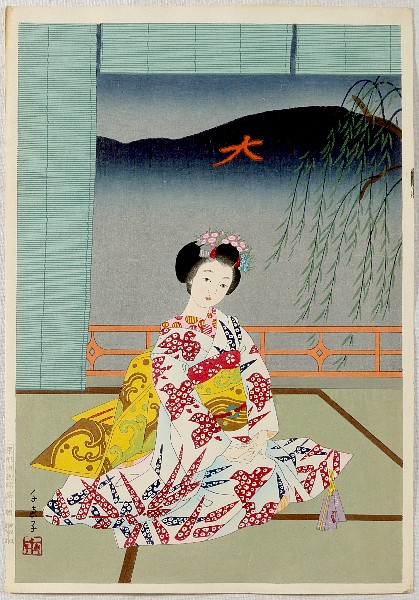
Where is `pink flowers`? The height and width of the screenshot is (600, 419). pink flowers is located at coordinates (205, 236), (213, 234), (202, 241), (212, 241), (224, 239), (231, 236), (233, 243), (242, 244), (239, 249).